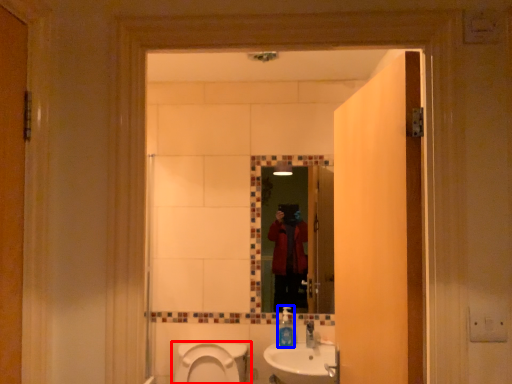
Question: Which object appears closest to the camera in this image, toilet (highlighted by a red box) or soap dispenser (highlighted by a blue box)?

Choices:
 (A) toilet
 (B) soap dispenser

Answer: (A)